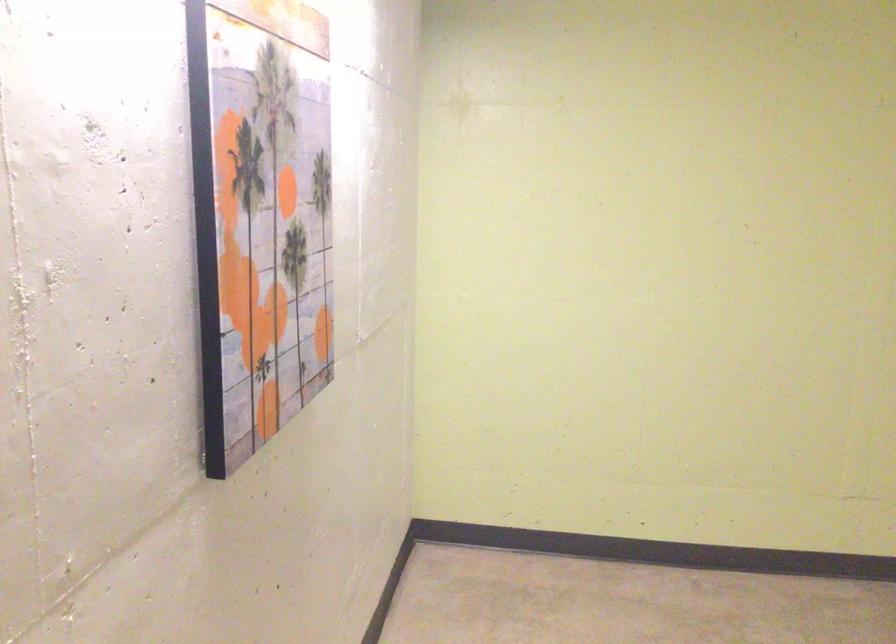
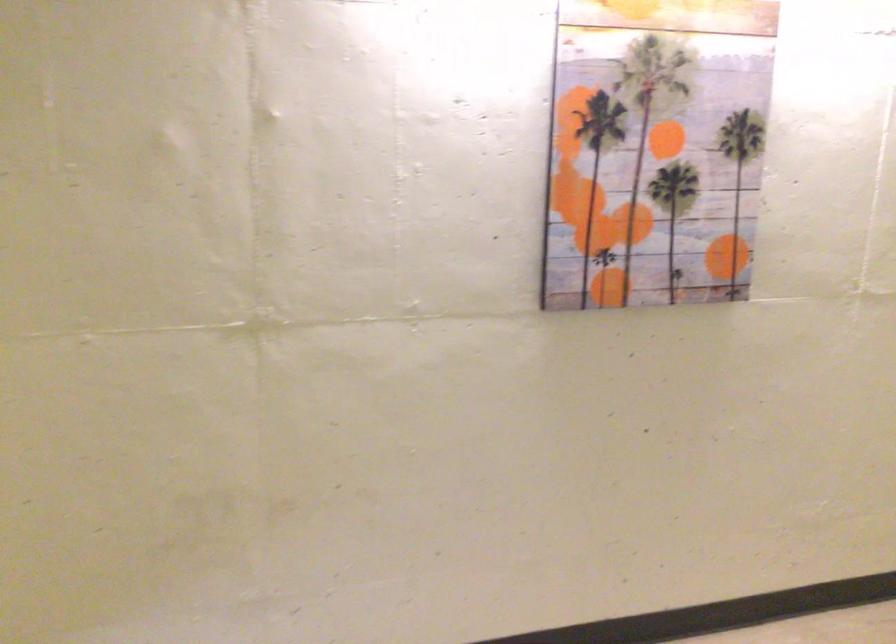
The point at (279, 200) is marked in the first image. Where is the corresponding point in the second image?

(655, 149)